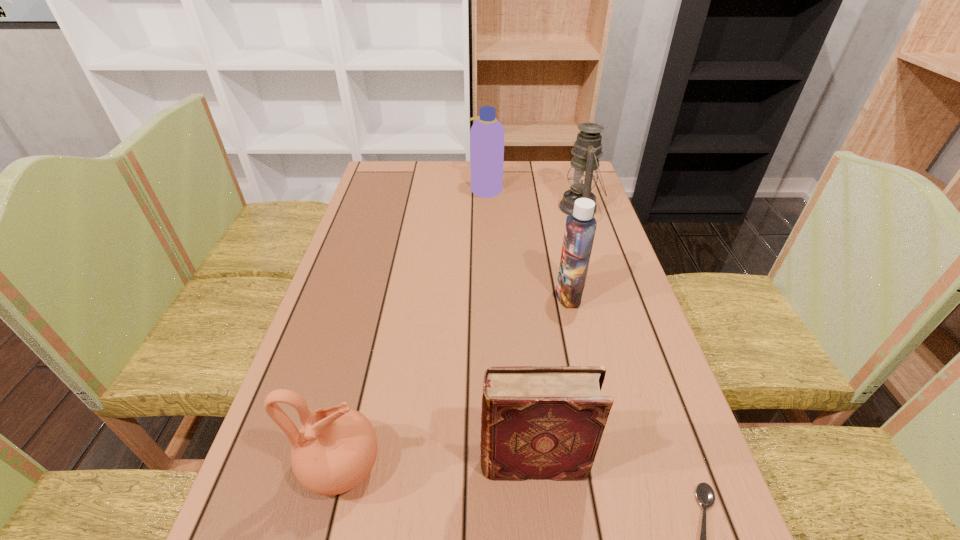
Find the location of a particular element. The height and width of the screenshot is (540, 960). object that is at the far right corner is located at coordinates (583, 173).

Locate an element on the screen. This screenshot has width=960, height=540. vacant space at the far edge of the desktop is located at coordinates (426, 167).

At what (x,y) coordinates should I click in order to perform the action: click on vacant space at the left edge. Please return your answer as a coordinate pair (x, y). Looking at the image, I should click on (328, 293).

Find the location of a particular element. This screenshot has width=960, height=540. vacant area at the right edge is located at coordinates (618, 317).

You are a GUI agent. You are given a task and a screenshot of the screen. Output one action in this format:
    pyautogui.click(x=<x>, y=<y>)
    Task: Click on the blank space at the far left corner of the desktop
    This screenshot has height=540, width=960.
    Given the screenshot: What is the action you would take?
    pyautogui.click(x=382, y=180)

Image resolution: width=960 pixels, height=540 pixels. I want to click on unoccupied area between the oil lamp and the hardback book, so click(x=557, y=335).

At what (x,y) coordinates should I click in order to perform the action: click on vacant space that's between the hardback book and the leftmost object. Please return your answer as a coordinate pair (x, y). The image size is (960, 540). Looking at the image, I should click on click(x=438, y=465).

Where is `vacant space in between the hardback book and the oil lamp`? vacant space in between the hardback book and the oil lamp is located at coordinates pyautogui.click(x=557, y=335).

The height and width of the screenshot is (540, 960). Find the location of `free space between the oil lamp and the leftmost object`. free space between the oil lamp and the leftmost object is located at coordinates (461, 337).

At what (x,y) coordinates should I click in order to perform the action: click on free area in between the left shampoo and the oil lamp. Please return your answer as a coordinate pair (x, y). The width and height of the screenshot is (960, 540). Looking at the image, I should click on (533, 198).